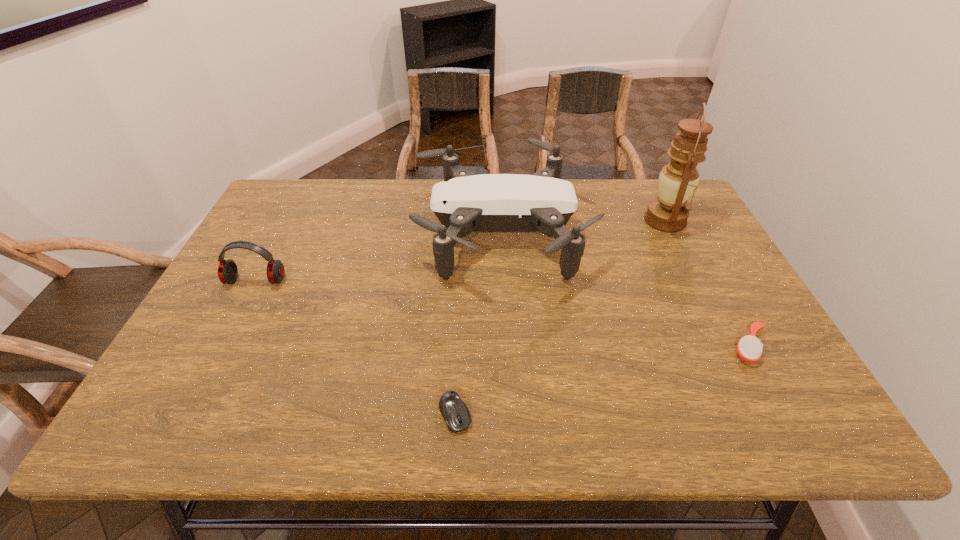
The width and height of the screenshot is (960, 540). I want to click on oil lamp, so click(x=678, y=179).

At what (x,y) coordinates should I click in order to perform the action: click on the fourth shortest object. Please return your answer as a coordinate pair (x, y). The height and width of the screenshot is (540, 960). Looking at the image, I should click on (464, 202).

This screenshot has width=960, height=540. Identify the location of the third shortest object. (227, 271).

At what (x,y) coordinates should I click in order to perform the action: click on earphone. Please return your answer as a coordinate pair (x, y). Looking at the image, I should click on (227, 271).

You are a GUI agent. You are given a task and a screenshot of the screen. Output one action in this format:
    pyautogui.click(x=<x>, y=<y>)
    Task: Click on the hairbrush
    The image size is (960, 540).
    Given the screenshot: What is the action you would take?
    pyautogui.click(x=749, y=348)

The height and width of the screenshot is (540, 960). Find the location of `the nearest object`. the nearest object is located at coordinates (456, 414).

The width and height of the screenshot is (960, 540). Find the location of `free space located on the front of the tallest object`. free space located on the front of the tallest object is located at coordinates (700, 291).

The width and height of the screenshot is (960, 540). In order to click on free spot located on the camera side of the fourth shortest object in this screenshot , I will do `click(387, 233)`.

Where is `vacant region located on the camera side of the fourth shortest object`? The width and height of the screenshot is (960, 540). vacant region located on the camera side of the fourth shortest object is located at coordinates (303, 233).

This screenshot has height=540, width=960. I want to click on vacant space situated on the camera side of the fourth shortest object, so click(373, 233).